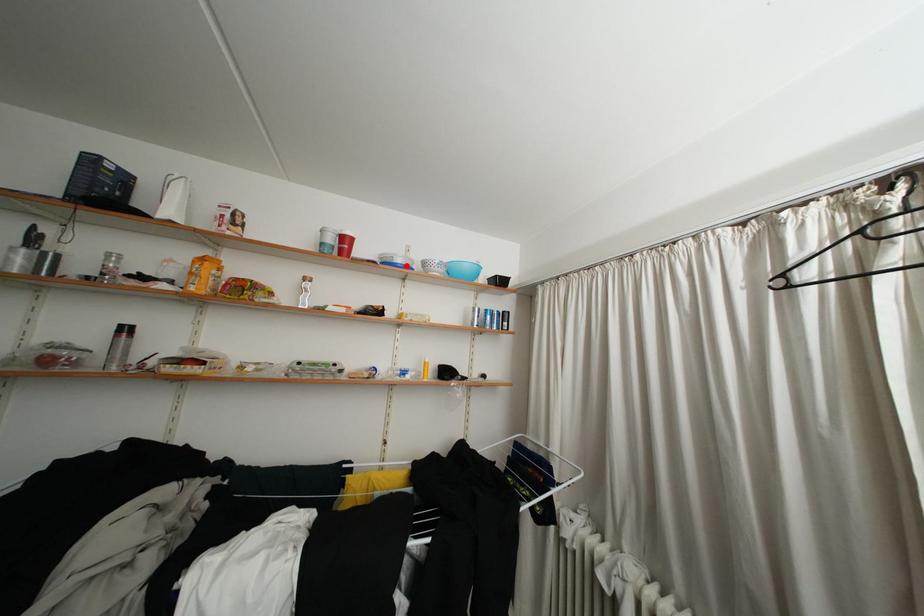
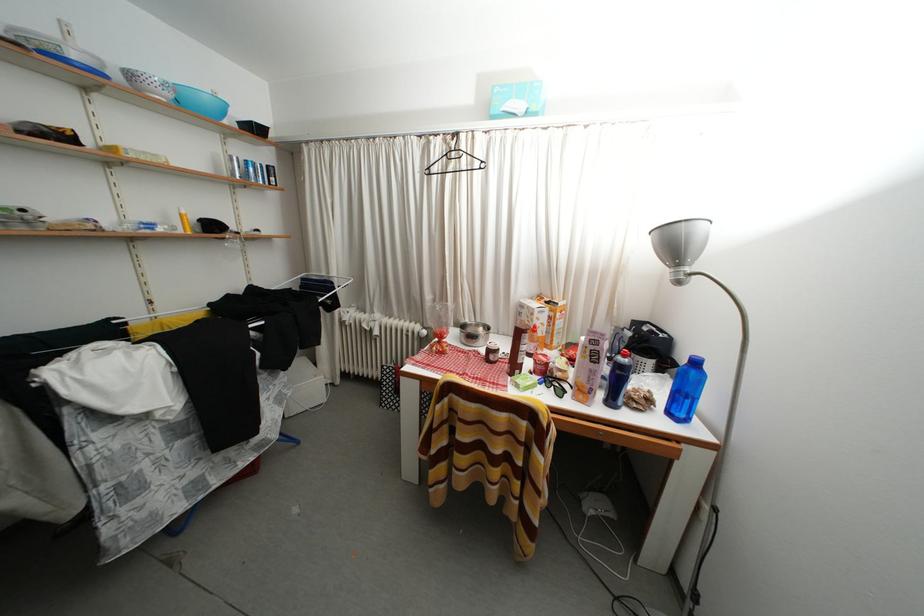
Locate, in the second image, the point that corresponds to the highlighted location in the first image.

(81, 61)